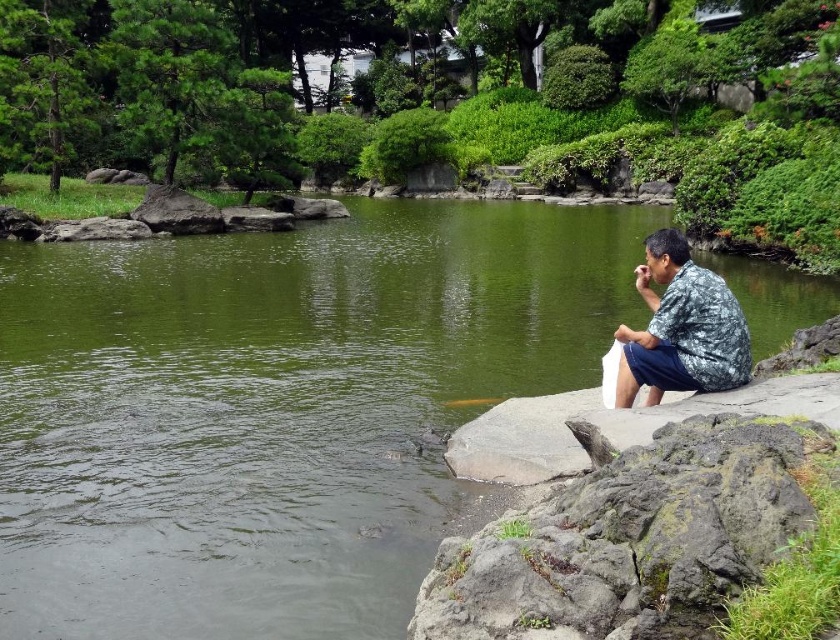
You are standing at the point labeled point (675, 387) and want to walk to the point labeled point (350, 579). Which direction should you move relative to your current position?

You should move forward because point (350, 579) is in front of point (675, 387).

Consider the image. You are a photographer planning to take a picture of the green water at center and the camouflage fabric shirt at right. Based on their positions, which object should you focus on first to ensure both are in sharp focus?

The green water at center is much taller than the camouflage fabric shirt at right, so focusing on the green water at center first would ensure both are in sharp focus since it is farther away.

You are standing in the Japanese garden and see the green water at center and the camouflage fabric shirt at right. Which object is closer to the pond?

The green water at center is closer to the pond because it is located at the center of the pond, while the camouflage fabric shirt at right is positioned on the right side near the stone wall bordering the pond.